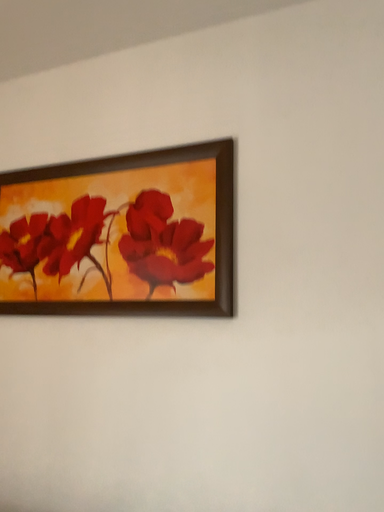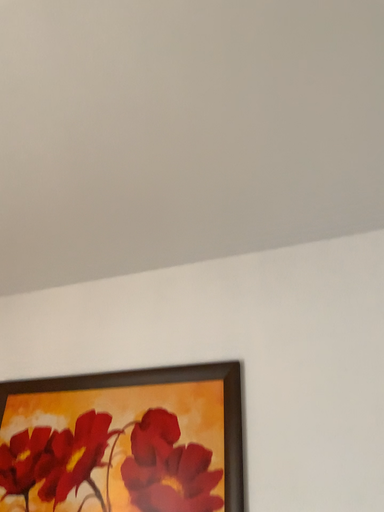
Question: Which way did the camera rotate in the video?

Choices:
 (A) rotated downward
 (B) rotated upward

Answer: (B)